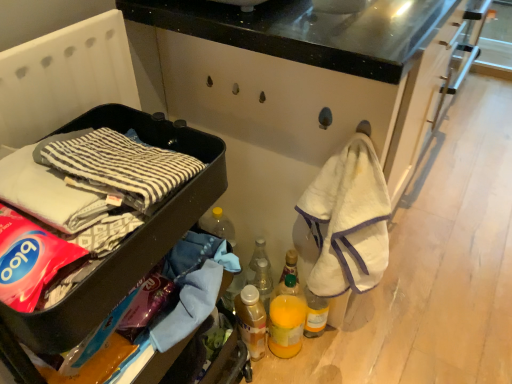
Find the location of `vacant area on top of black plastic container at left (from a real-world perspective)`. vacant area on top of black plastic container at left (from a real-world perspective) is located at coordinates (83, 183).